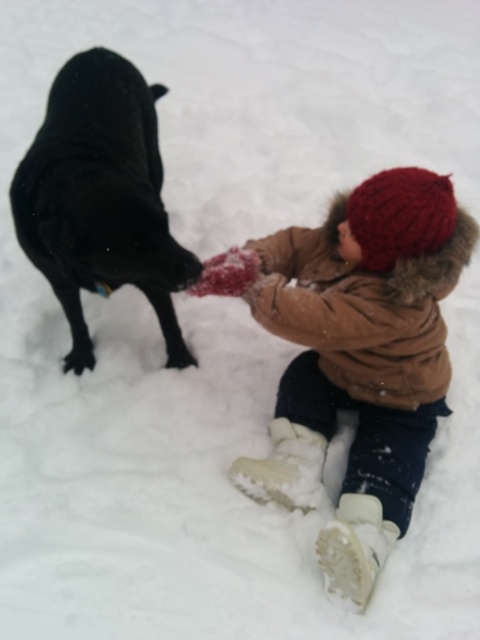
Does point (337, 216) lie behind point (60, 166)?

Yes, point (337, 216) is farther from viewer.

Which is in front, point (380, 248) or point (86, 104)?

Point (380, 248)

Locate an element on the screen. This screenshot has width=480, height=640. knitted woolen hat at upper center is located at coordinates (355, 355).